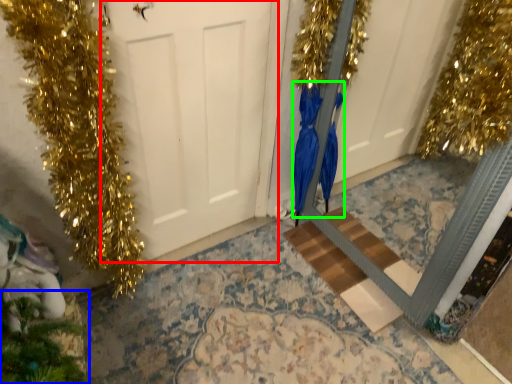
Question: Which object is positioned farthest from door (highlighted by a red box)? Select from christmas decoration (highlighted by a blue box) and dress (highlighted by a green box).

Choices:
 (A) christmas decoration
 (B) dress

Answer: (A)